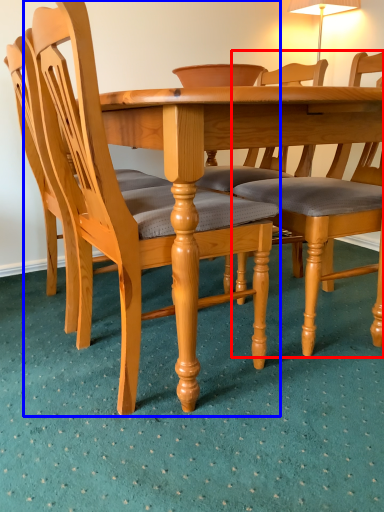
Question: Which object is further to the camera taking this photo, chair (highlighted by a red box) or chair (highlighted by a blue box)?

Choices:
 (A) chair
 (B) chair

Answer: (A)